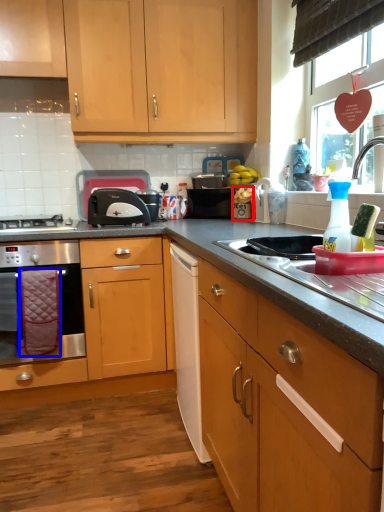
Question: Which point is further to the camera, appliance (highlighted by a red box) or material (highlighted by a blue box)?

Choices:
 (A) appliance
 (B) material

Answer: (A)